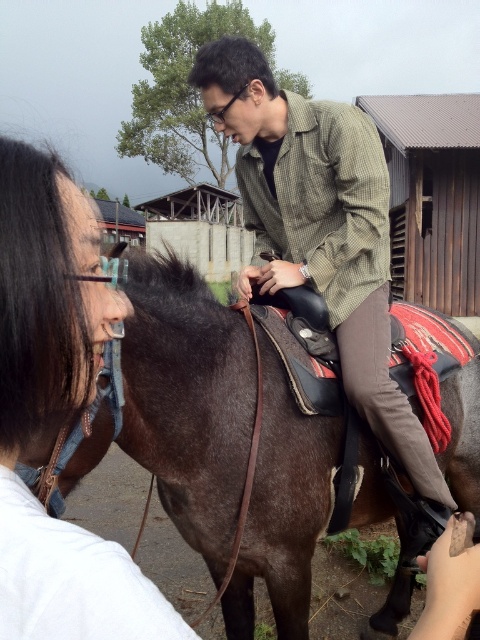
You are a photographer trying to capture a clear shot of the brown leather horse at center and the green checkered shirt at center. Based on their sizes in the image, which object should you focus on first to ensure it doesn

The brown leather horse at center occupies less space than the green checkered shirt at center, so you should focus on the brown leather horse at center first to ensure it is in focus before adjusting for the larger shirt.

Based on the photo, you are standing at the point marked as point (201, 380) and want to take a photo of the person on the horse. The camera you have can only focus on objects within 2 meters. Will the camera be able to focus on the person on the horse?

The point (201, 380) is 2.12 meters from the camera, which is beyond the camera focus range of 2 meters. Therefore, the camera will not be able to focus on the person on the horse.

You are a photographer trying to capture a portrait of the brown leather horse at center and the smooth brown hair at left. Which subject is positioned lower in the frame?

The brown leather horse at center is positioned lower than the smooth brown hair at left in the frame.